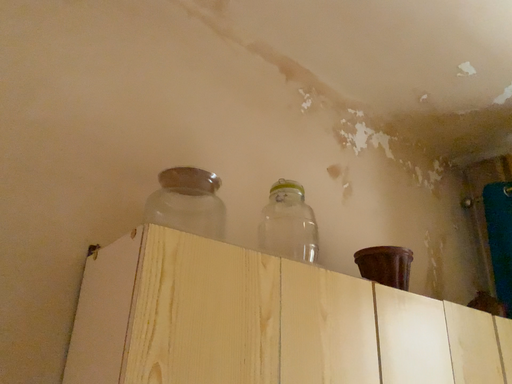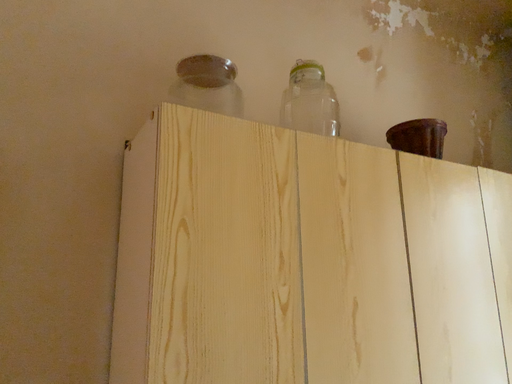
Question: How did the camera likely rotate when shooting the video?

Choices:
 (A) rotated upward
 (B) rotated downward

Answer: (B)